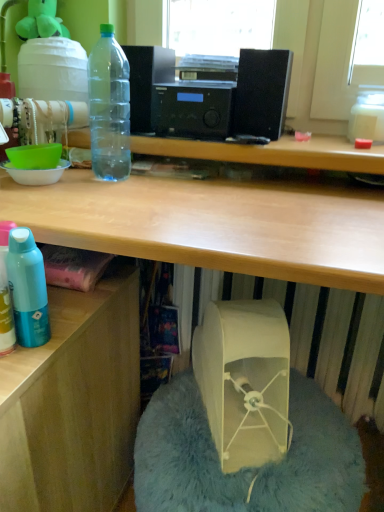
Question: Can we say beige fabric bean bag chair at lower center lies outside beige fabric bag at lower center?

Choices:
 (A) no
 (B) yes

Answer: (B)

Question: Is beige fabric bean bag chair at lower center directly adjacent to beige fabric bag at lower center?

Choices:
 (A) yes
 (B) no

Answer: (B)

Question: Considering the relative sizes of beige fabric bean bag chair at lower center and beige fabric bag at lower center in the image provided, is beige fabric bean bag chair at lower center shorter than beige fabric bag at lower center?

Choices:
 (A) yes
 (B) no

Answer: (B)

Question: Is beige fabric bean bag chair at lower center thinner than beige fabric bag at lower center?

Choices:
 (A) no
 (B) yes

Answer: (A)

Question: From a real-world perspective, is beige fabric bean bag chair at lower center physically below beige fabric bag at lower center?

Choices:
 (A) yes
 (B) no

Answer: (A)

Question: Is beige fabric bean bag chair at lower center far away from beige fabric bag at lower center?

Choices:
 (A) yes
 (B) no

Answer: (B)

Question: Is transparent plastic water cooler at upper left taller than wooden desk at lower left?

Choices:
 (A) yes
 (B) no

Answer: (B)

Question: Can you confirm if transparent plastic water cooler at upper left is wider than wooden desk at lower left?

Choices:
 (A) yes
 (B) no

Answer: (B)

Question: Would you say transparent plastic water cooler at upper left contains wooden desk at lower left?

Choices:
 (A) yes
 (B) no

Answer: (B)

Question: Would you consider transparent plastic water cooler at upper left to be distant from wooden desk at lower left?

Choices:
 (A) yes
 (B) no

Answer: (B)

Question: From a real-world perspective, is transparent plastic water cooler at upper left positioned over wooden desk at lower left based on gravity?

Choices:
 (A) no
 (B) yes

Answer: (B)

Question: Is transparent plastic water cooler at upper left at the left side of wooden desk at lower left?

Choices:
 (A) no
 (B) yes

Answer: (A)

Question: Does beige fabric bag at lower center have a greater width compared to beige fabric bean bag chair at lower center?

Choices:
 (A) yes
 (B) no

Answer: (B)